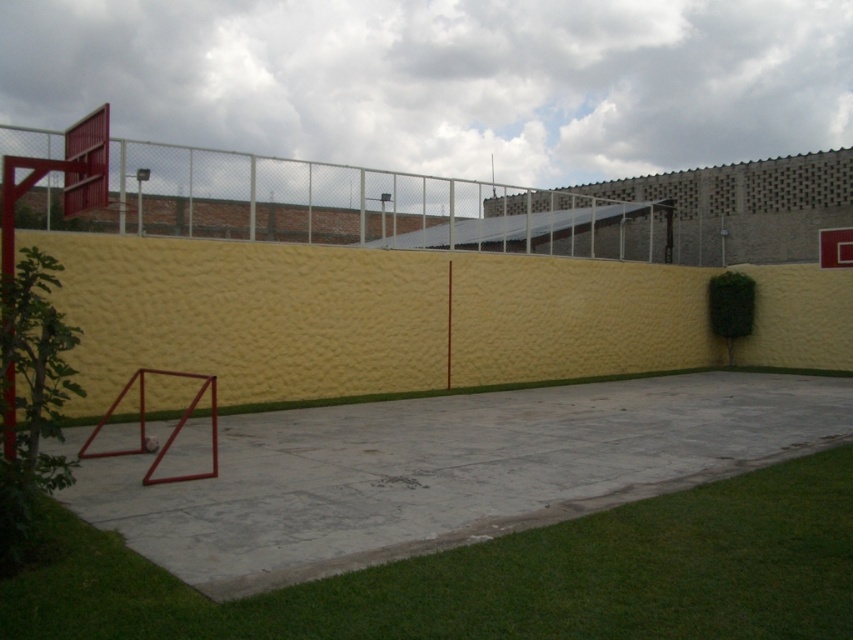
You are standing at the center of the basketball court and want to walk to the green grass at lower left. Which direction should you walk to reach it?

To reach the green grass at lower left, you should walk towards the lower left direction from the center of the basketball court.

You are a landscape architect designing a new outdoor space. You need to decide whether to place a new bench between the green grass at lower left and the metallic red basketball hoop at upper left. Given that the bench requires a minimum width of 1 meter, can the space between them accommodate it?

The green grass at lower left has a width less than the metallic red basketball hoop at upper left. However, the exact width of the space between them isn t specified in the description. Without knowing the actual distance, it s impossible to determine if the bench will fit. More information is needed.

You are a maintenance worker checking the basketball court. You need to determine if the green grass at lower left is taller than the metallic red basketball hoop at upper left. What do you observe?

The green grass at lower left has a lesser height compared to the metallic red basketball hoop at upper left, so the grass is shorter than the hoop.